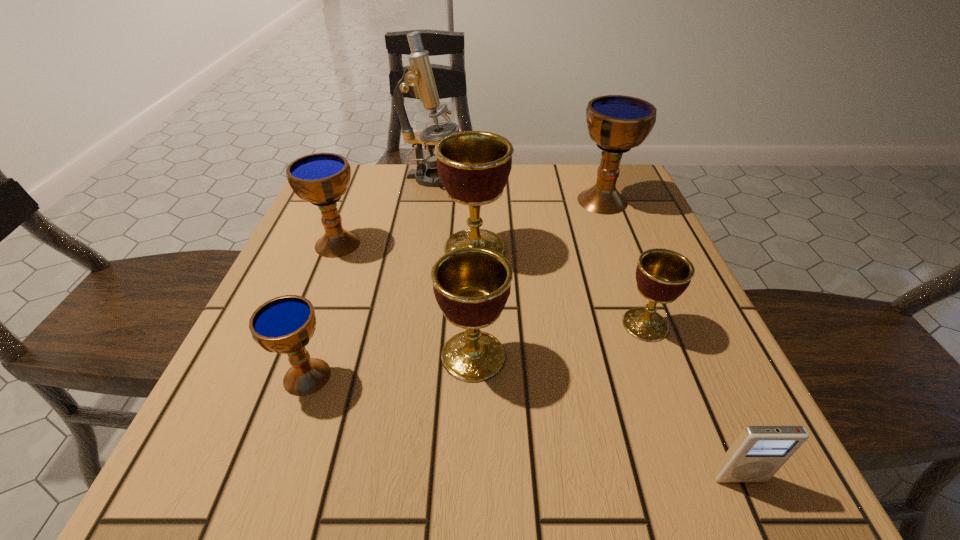
Identify the location of free spot located on the front of the microscope. The width and height of the screenshot is (960, 540). (423, 242).

Find the location of a particular element. The height and width of the screenshot is (540, 960). vacant area located on the left of the farthest chalice is located at coordinates (548, 201).

Locate an element on the screen. This screenshot has width=960, height=540. vacant space located on the front of the biggest golden chalice is located at coordinates (474, 333).

Where is `vacant space located 0.310m on the right of the second farthest blue chalice`? This screenshot has height=540, width=960. vacant space located 0.310m on the right of the second farthest blue chalice is located at coordinates pos(512,244).

This screenshot has width=960, height=540. I want to click on vacant space located 0.250m on the left of the second biggest golden chalice, so [x=283, y=356].

Identify the location of vacant space located 0.080m on the front of the rightmost golden chalice. (667, 384).

I want to click on vacant space located on the back of the smallest blue chalice, so click(356, 236).

Where is `microscope at the far edge`? microscope at the far edge is located at coordinates (418, 80).

You are a GUI agent. You are given a task and a screenshot of the screen. Output one action in this format:
    pyautogui.click(x=<x>, y=<y>)
    Task: Click on the chalice at the far edge
    
    Given the screenshot: What is the action you would take?
    pyautogui.click(x=616, y=123)

Identify the location of object that is at the near edge. (758, 452).